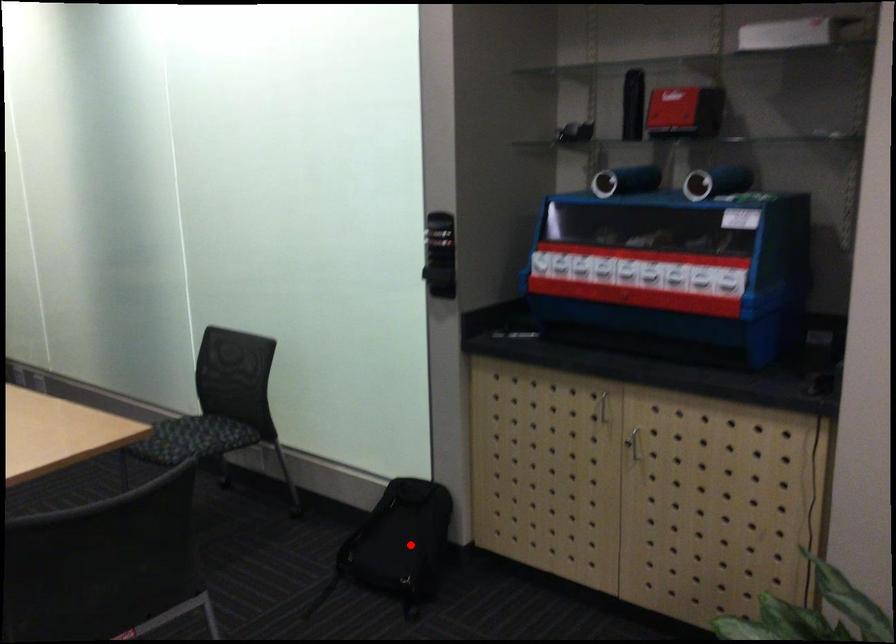
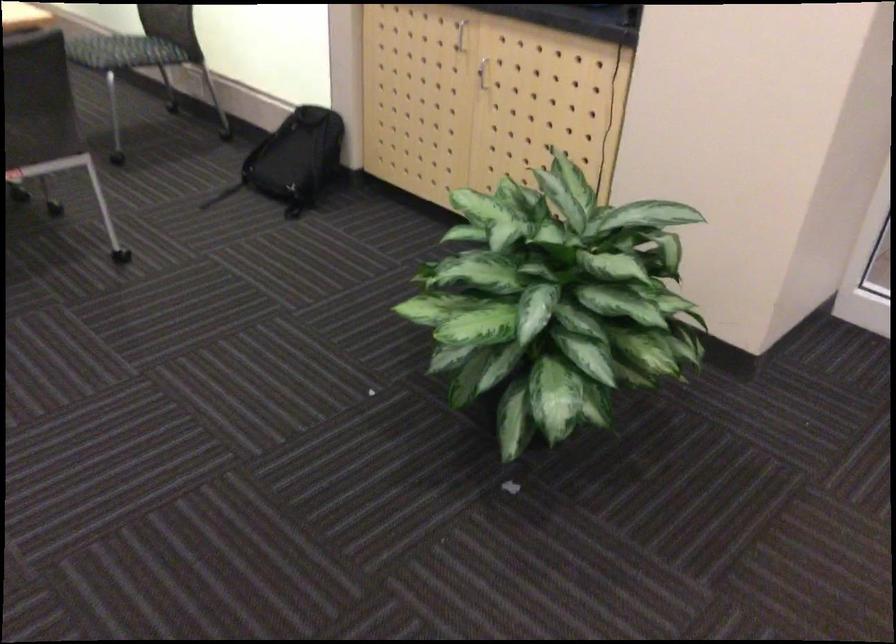
Question: I am providing you with two images of the same scene from different viewpoints. A red point is marked on the first image. At the location where the point appears in image 1, is it still visible in image 2?

Choices:
 (A) Yes
 (B) No

Answer: (A)